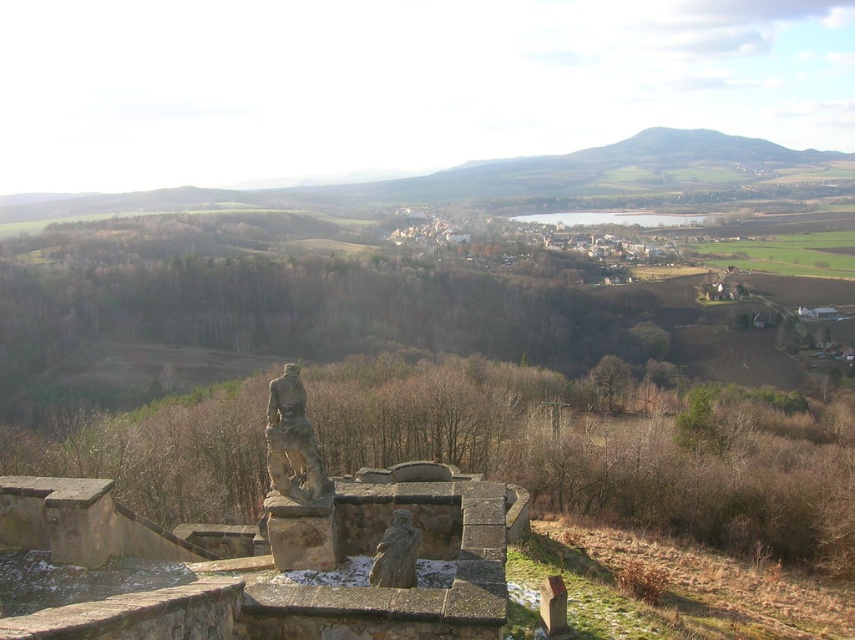
Question: Does stone statue at center have a larger size compared to rustic stone statue at center?

Choices:
 (A) no
 (B) yes

Answer: (B)

Question: Which object appears closest to the camera in this image?

Choices:
 (A) rustic stone statue at center
 (B) stone statue at center

Answer: (A)

Question: Is stone statue at center smaller than rustic stone statue at center?

Choices:
 (A) yes
 (B) no

Answer: (B)

Question: Which object appears closest to the camera in this image?

Choices:
 (A) stone statue at center
 (B) rustic stone statue at center

Answer: (B)

Question: Does stone statue at center have a lesser width compared to rustic stone statue at center?

Choices:
 (A) no
 (B) yes

Answer: (A)